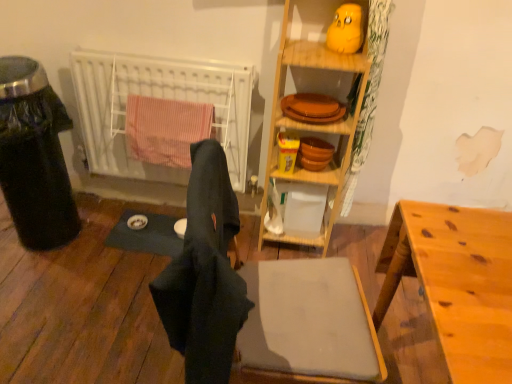
This screenshot has width=512, height=384. In order to click on free space between dark gray fabric yoga mat at center and transparent plastic trash can at left in this screenshot , I will do `click(108, 232)`.